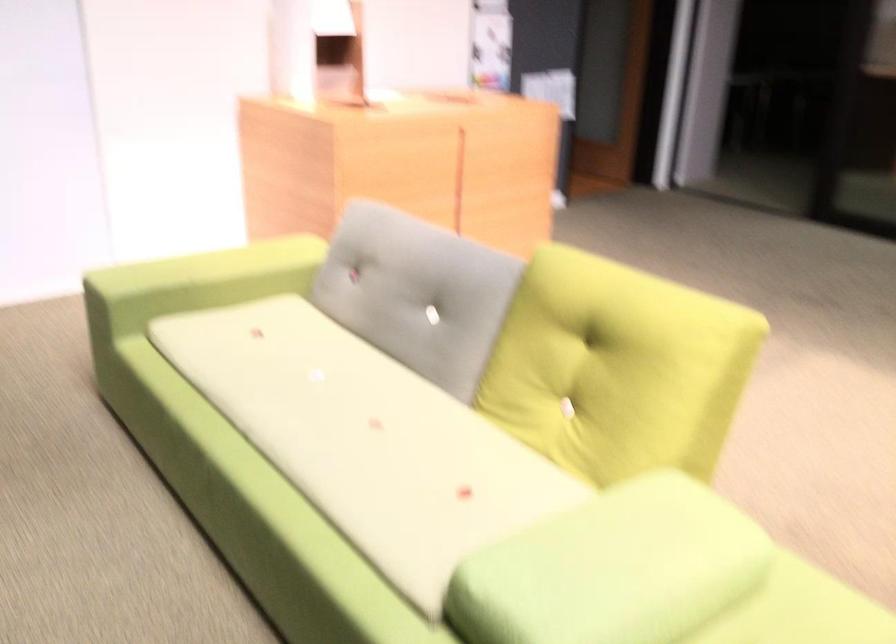
Where would you lift the yellow back cushion? Please return your answer as a coordinate pair (x, y).

(616, 368)